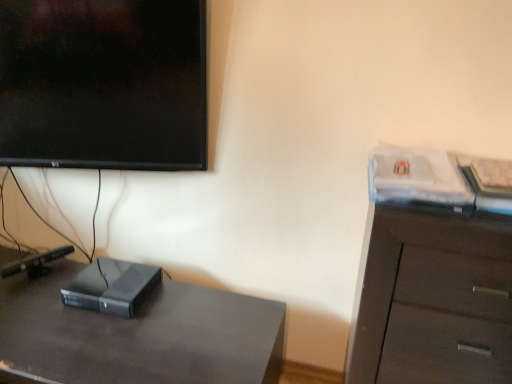
Where is `black matte desk at lower left`? This screenshot has height=384, width=512. black matte desk at lower left is located at coordinates [x=138, y=336].

This screenshot has height=384, width=512. Describe the element at coordinates (434, 301) in the screenshot. I see `dark wood cabinet at right` at that location.

Where is `black matte desk at lower left`? black matte desk at lower left is located at coordinates (138, 336).

Based on the photo, from a real-world perspective, is black matte desk at lower left below black matte computer at lower left?

Indeed, from a real-world perspective, black matte desk at lower left is positioned beneath black matte computer at lower left.

From the image's perspective, is black matte desk at lower left located above or below black matte computer at lower left?

black matte desk at lower left is situated lower than black matte computer at lower left in the image.

At what (x,y) coordinates should I click in order to perform the action: click on computer lying on the right of black matte desk at lower left. Please return your answer as a coordinate pair (x, y). This screenshot has width=512, height=384. Looking at the image, I should click on (112, 287).

Based on the photo, from the image's perspective, is black matte desk at lower left under dark wood cabinet at right?

Yes, from the image's perspective, black matte desk at lower left is below dark wood cabinet at right.

Which object is positioned more to the right, black matte desk at lower left or dark wood cabinet at right?

Positioned to the right is dark wood cabinet at right.

Which is closer to the camera, (162,351) or (354,374)?

The point (354,374) is more forward.

Considering the sizes of black matte desk at lower left and dark wood cabinet at right in the image, is black matte desk at lower left taller or shorter than dark wood cabinet at right?

Considering their sizes, black matte desk at lower left has less height than dark wood cabinet at right.

How different are the orientations of black matte computer at lower left and dark wood cabinet at right in degrees?

4.8e-05 degrees.

Who is bigger, black matte computer at lower left or dark wood cabinet at right?

dark wood cabinet at right is bigger.

Is black matte computer at lower left next to dark wood cabinet at right and touching it?

No, black matte computer at lower left is not in contact with dark wood cabinet at right.

Is dark wood cabinet at right inside the boundaries of black matte computer at lower left, or outside?

dark wood cabinet at right cannot be found inside black matte computer at lower left.

Is dark wood cabinet at right oriented away from black matte computer at lower left?

dark wood cabinet at right does not have its back to black matte computer at lower left.

Does point (485, 366) come farther from viewer compared to point (114, 289)?

No, it is not.

Considering the sizes of objects dark wood cabinet at right and black matte computer at lower left in the image provided, who is smaller, dark wood cabinet at right or black matte computer at lower left?

black matte computer at lower left.

Measure the distance between black matte computer at lower left and black matte desk at lower left.

A distance of 16.09 centimeters exists between black matte computer at lower left and black matte desk at lower left.

Which of these two, black matte computer at lower left or black matte desk at lower left, is bigger?

black matte desk at lower left is bigger.

In terms of height, does black matte computer at lower left look taller or shorter compared to black matte desk at lower left?

In the image, black matte computer at lower left appears to be shorter than black matte desk at lower left.

Is black matte desk at lower left completely or partially inside black matte computer at lower left?

No, black matte desk at lower left is located outside of black matte computer at lower left.

Would you say dark wood cabinet at right contains black matte desk at lower left?

That's incorrect, black matte desk at lower left is not inside dark wood cabinet at right.

Consider the image. Is dark wood cabinet at right looking in the opposite direction of black matte desk at lower left?

No.

Between point (462, 374) and point (40, 286), which one is positioned in front?

The point (462, 374) is closer to the camera.

Find the location of a particular element. The image size is (512, 384). desk that appears on the left of black matte computer at lower left is located at coordinates (138, 336).

I want to click on desk lying behind the dark wood cabinet at right, so pyautogui.click(x=138, y=336).

When comparing their distances from black matte desk at lower left, does black matte computer at lower left or dark wood cabinet at right seem further?

dark wood cabinet at right is positioned further to the anchor black matte desk at lower left.

Considering their positions, is dark wood cabinet at right positioned further to black matte computer at lower left than black matte desk at lower left?

dark wood cabinet at right is positioned further to the anchor black matte computer at lower left.

Looking at the image, which one is located further to black matte computer at lower left, black matte desk at lower left or dark wood cabinet at right?

Based on the image, dark wood cabinet at right appears to be further to black matte computer at lower left.

From the image, which object appears to be nearer to dark wood cabinet at right, black matte desk at lower left or black matte computer at lower left?

Based on the image, black matte desk at lower left appears to be nearer to dark wood cabinet at right.

Looking at the image, which one is located closer to black matte desk at lower left, dark wood cabinet at right or black matte computer at lower left?

Based on the image, black matte computer at lower left appears to be nearer to black matte desk at lower left.

When comparing their distances from dark wood cabinet at right, does black matte computer at lower left or black matte desk at lower left seem closer?

The object closer to dark wood cabinet at right is black matte desk at lower left.

This screenshot has width=512, height=384. Find the location of `computer between black matte desk at lower left and dark wood cabinet at right`. computer between black matte desk at lower left and dark wood cabinet at right is located at coordinates (112, 287).